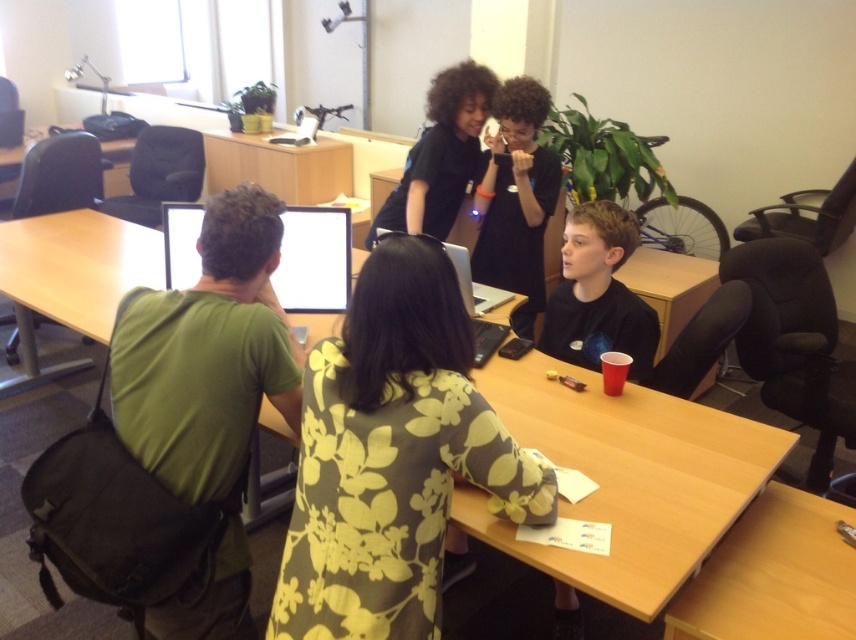
You are trying to place a tall plant next to the light brown wood table at lower right without blocking the view of the white glossy monitor at upper center. Considering their heights, will the plant be visible from the monitor?

The light brown wood table at lower right has a lesser height compared to the white glossy monitor at upper center. Therefore, placing a tall plant next to the light brown wood table at lower right would likely block the view of the white glossy monitor at upper center since the plant would be taller than the table and could obstruct the line of sight.